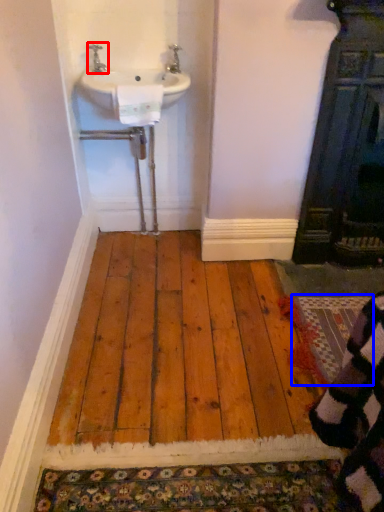
Question: Among these objects, which one is nearest to the camera, tap (highlighted by a red box) or doormat (highlighted by a blue box)?

Choices:
 (A) tap
 (B) doormat

Answer: (B)